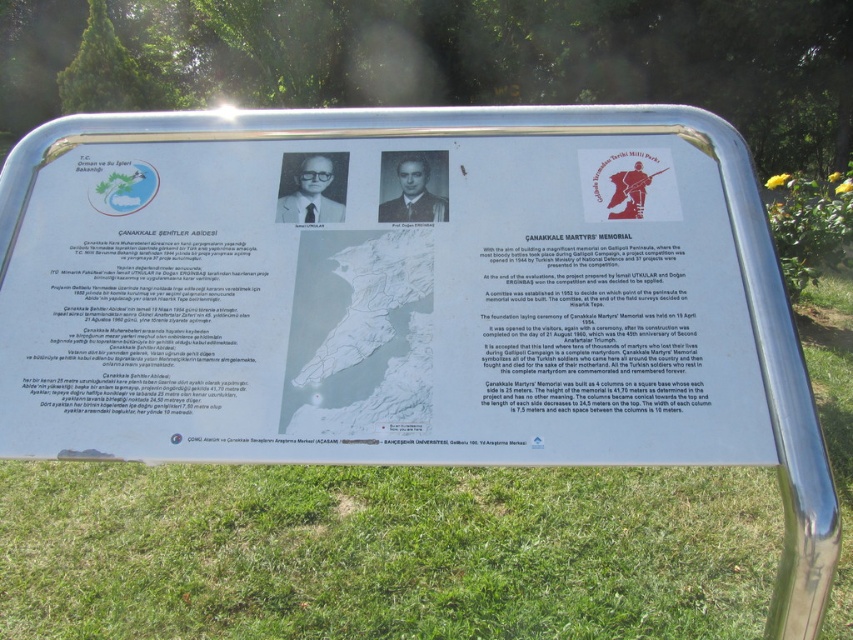
You are a tourist standing in front of the memorial plaque. You notice the silver metallic sign at center and the green grass at lower center. Which object is directly above the other?

The silver metallic sign at center is positioned over the green grass at lower center.

You are a visitor at the memorial site. You see the silver metallic sign at center and the green grass at lower center. Which object is taller?

The silver metallic sign at center is taller than the green grass at lower center.

What is the exact location of the silver metallic sign at center in the image?

The silver metallic sign at center is located at point (x=379, y=300).